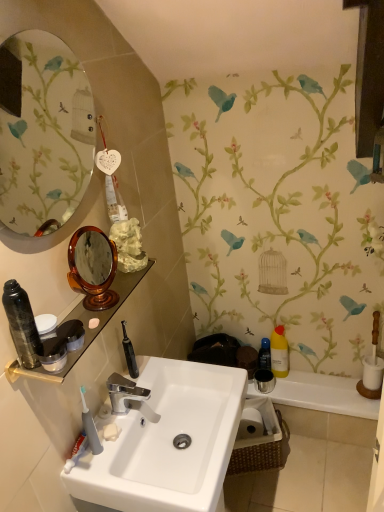
Question: Is yellow translucent bottle at right, acting as the 3th toiletry starting from the front, wider or thinner than metallic silver cup at right?

Choices:
 (A) wide
 (B) thin

Answer: (B)

Question: Considering the positions of yellow translucent bottle at right, arranged as the second toiletry when viewed from the back, and metallic silver cup at right in the image, is yellow translucent bottle at right, arranged as the second toiletry when viewed from the back, taller or shorter than metallic silver cup at right?

Choices:
 (A) short
 (B) tall

Answer: (B)

Question: Which is farther from the shiny black canister at left, which is the 4th toiletry in back-to-front order?

Choices:
 (A) polished chrome faucet at center
 (B) white glossy sink at center
 (C) yellow translucent bottle at right, arranged as the 1th toiletry when viewed from the right
 (D) gray rubber toothbrush at lower left
 (E) transparent plastic bottle at lower right, the 2th toiletry when ordered from right to left

Answer: (E)

Question: Which of these objects is positioned closest to the shiny black canister at left, which is the 1th toiletry from front to back?

Choices:
 (A) yellow translucent bottle at right, arranged as the 1th toiletry when viewed from the right
 (B) oval glass mirror at upper left
 (C) transparent plastic bottle at lower right, the fourth toiletry when ordered from front to back
 (D) polished chrome faucet at center
 (E) gray rubber toothbrush at lower left

Answer: (E)